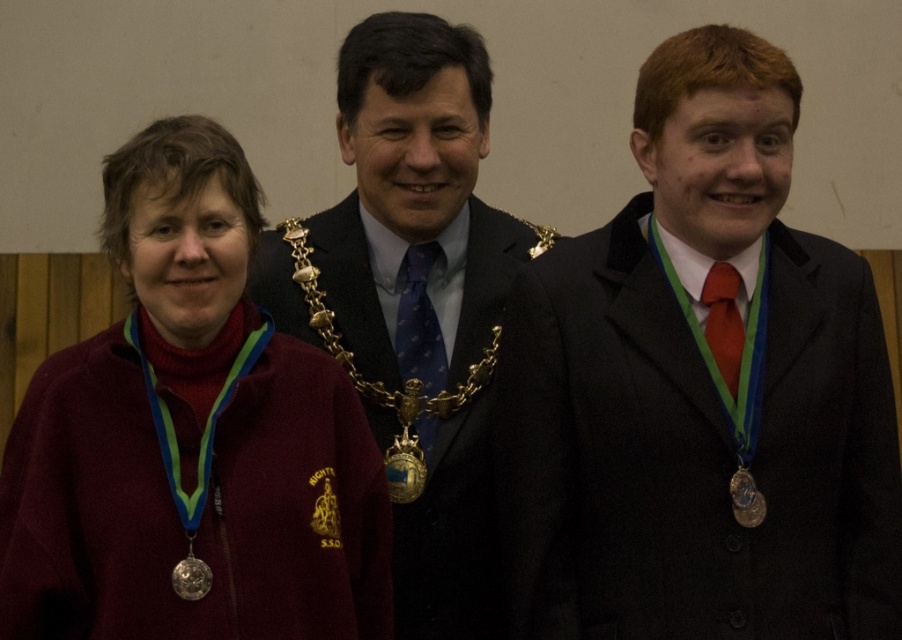
You are a photographer setting up for a group photo. You need to ensure that the metallic gold chain at center and the gold metallic chain at center are both visible in the frame. Which chain should you adjust to avoid overlapping with the other?

The metallic gold chain at center is to the right of the gold metallic chain at center, so you should adjust the gold metallic chain at center to move it further left to prevent overlapping.

You are trying to locate the gold metallic chain at center in the image. What are its coordinates?

The gold metallic chain at center is located at coordinates point [380,381].

You are a photographer adjusting the camera focus. You need to ensure that both the gold metallic chain at center and the blue textured tie at center are in focus. Which object should you focus on first to ensure both are sharp?

You should focus on the gold metallic chain at center first since it is larger than the blue textured tie at center, allowing for better focus adjustment.